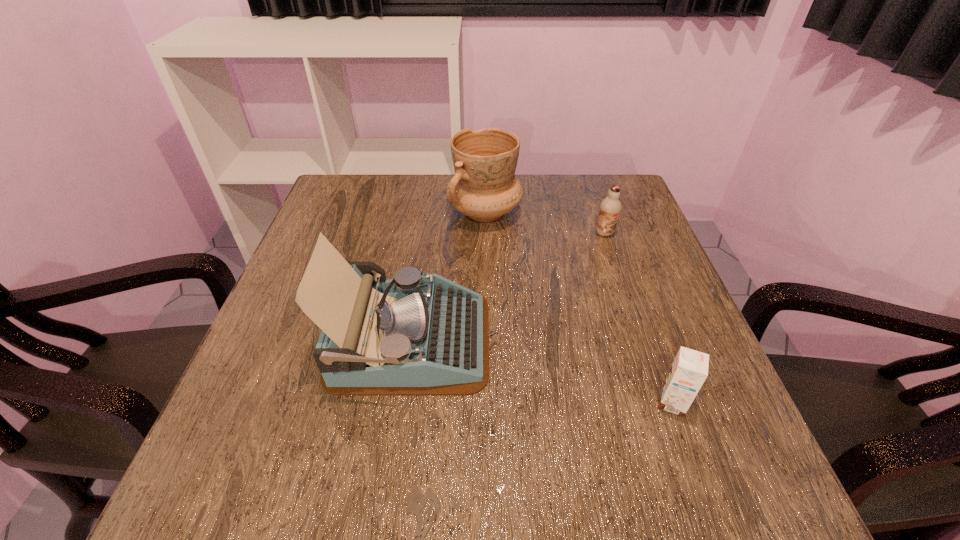
Locate an element on the screen. The height and width of the screenshot is (540, 960). vacant space at the far edge of the desktop is located at coordinates (433, 210).

At what (x,y) coordinates should I click in order to perform the action: click on vacant space at the left edge. Please return your answer as a coordinate pair (x, y). Looking at the image, I should click on (292, 303).

Where is `free space at the right edge`? This screenshot has height=540, width=960. free space at the right edge is located at coordinates (667, 448).

You are a GUI agent. You are given a task and a screenshot of the screen. Output one action in this format:
    pyautogui.click(x=<x>, y=<y>)
    Task: Click on the blank area at the far left corner
    
    Given the screenshot: What is the action you would take?
    pyautogui.click(x=353, y=177)

The image size is (960, 540). I want to click on free location at the near left corner of the desktop, so click(239, 482).

Identify the location of vacant space at the far right corner of the desktop. This screenshot has width=960, height=540. (585, 217).

Find the location of a particular element. free space between the nearer chocolate milk and the typewriter is located at coordinates (541, 372).

The height and width of the screenshot is (540, 960). I want to click on free space between the farther chocolate milk and the nearer chocolate milk, so click(x=638, y=318).

You are a GUI agent. You are given a task and a screenshot of the screen. Output one action in this format:
    pyautogui.click(x=<x>, y=<y>)
    Task: Click on the unoccupied area between the typewriter and the farther chocolate milk
    The image size is (960, 540).
    Given the screenshot: What is the action you would take?
    click(508, 287)

In order to click on free spot between the typewriter and the nearer chocolate milk in this screenshot , I will do `click(541, 372)`.